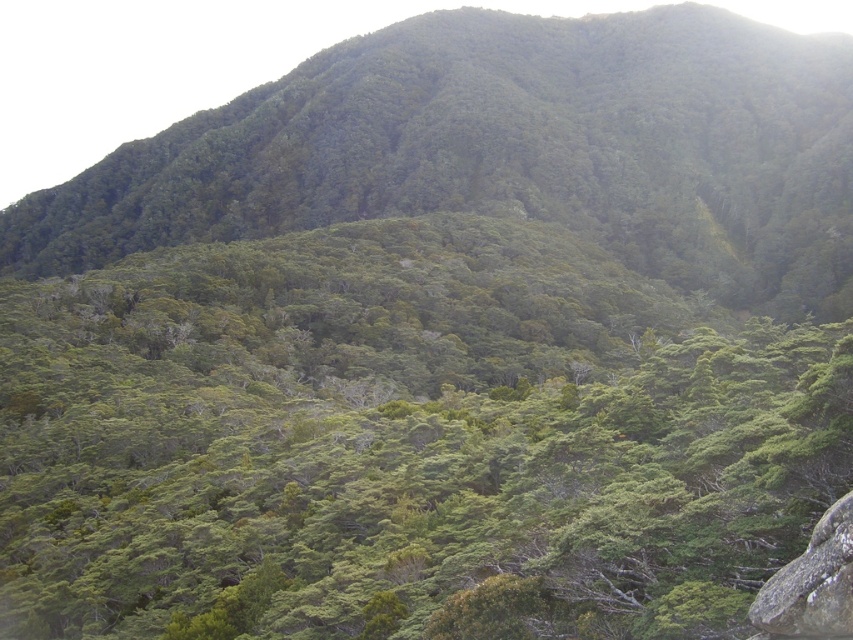
This screenshot has width=853, height=640. Find the location of `green leafy hillside at center`. green leafy hillside at center is located at coordinates pyautogui.click(x=509, y=148).

Does green leafy hillside at center appear on the left side of gray rough rock at lower right?

Indeed, green leafy hillside at center is positioned on the left side of gray rough rock at lower right.

Measure the distance between green leafy hillside at center and camera.

green leafy hillside at center and camera are 224.74 meters apart from each other.

Where is `green leafy hillside at center`? This screenshot has height=640, width=853. green leafy hillside at center is located at coordinates (509, 148).

Does point (694, 420) come in front of point (827, 564)?

No, it is not.

Can you confirm if green leafy tree at center is wider than gray rough rock at lower right?

Yes.

At what (x,y) coordinates should I click in order to perform the action: click on green leafy tree at center. Please return your answer as a coordinate pair (x, y). The height and width of the screenshot is (640, 853). Looking at the image, I should click on (402, 438).

The height and width of the screenshot is (640, 853). I want to click on green leafy tree at center, so click(402, 438).

Does green leafy tree at center have a lesser height compared to green leafy hillside at center?

Indeed, green leafy tree at center has a lesser height compared to green leafy hillside at center.

Between point (22, 499) and point (532, 161), which one is positioned behind?

Positioned behind is point (532, 161).

Measure the distance between point (x=195, y=528) and camera.

Point (x=195, y=528) and camera are 155.42 feet apart.

Where is `green leafy tree at center`? green leafy tree at center is located at coordinates point(402,438).